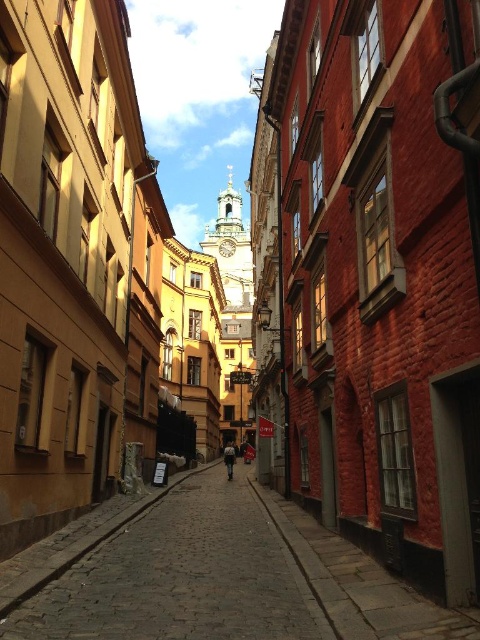
Question: Is cobblestone alley at center to the left of dark blue denim jacket at center from the viewer's perspective?

Choices:
 (A) yes
 (B) no

Answer: (B)

Question: Is cobblestone alley at center wider than dark blue denim jacket at center?

Choices:
 (A) no
 (B) yes

Answer: (B)

Question: Is cobblestone alley at center to the left of dark blue denim jacket at center from the viewer's perspective?

Choices:
 (A) no
 (B) yes

Answer: (A)

Question: Which point is farther from the camera taking this photo?

Choices:
 (A) (228, 451)
 (B) (385, 625)

Answer: (A)